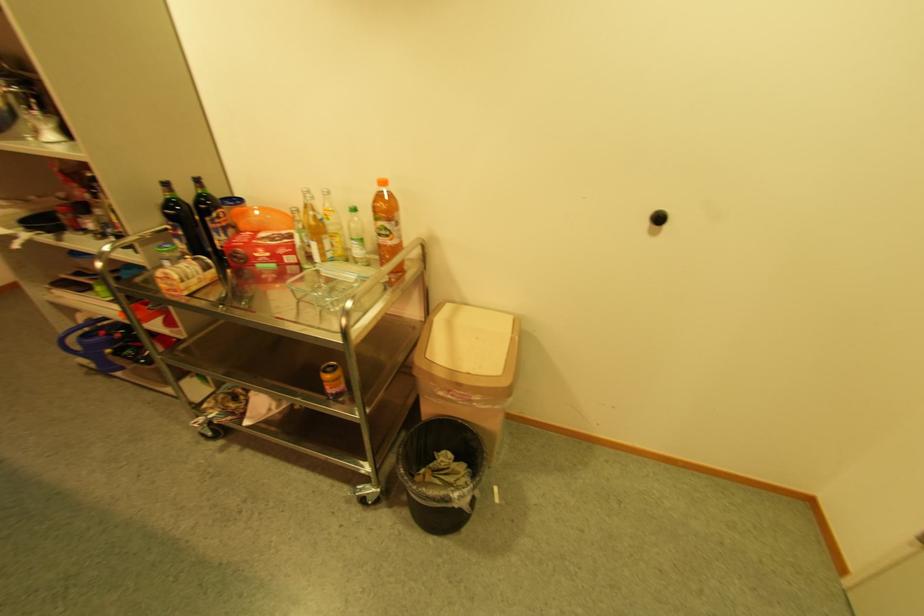
Find the location of `green glass bottle`. green glass bottle is located at coordinates (180, 222).